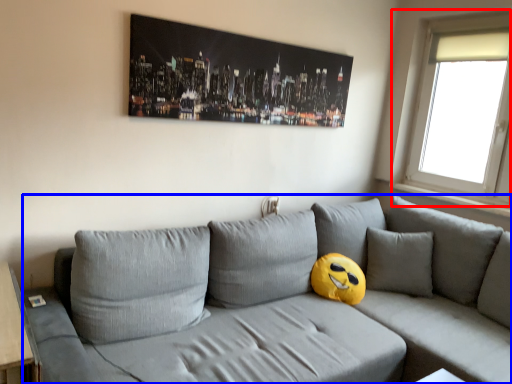
Question: Which of the following is the closest to the observer, window (highlighted by a red box) or studio couch (highlighted by a blue box)?

Choices:
 (A) window
 (B) studio couch

Answer: (B)